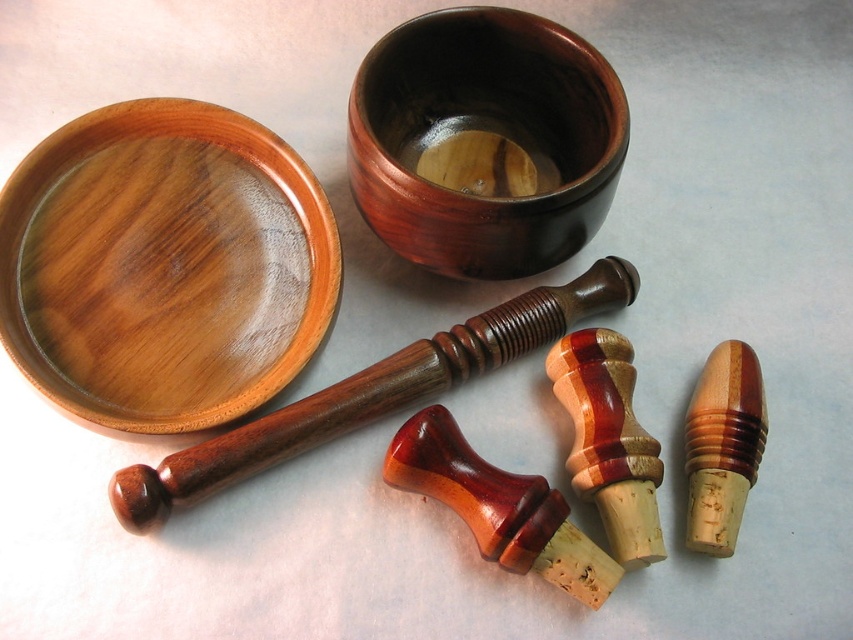
Question: Does wooden bowl at upper left have a lesser width compared to dark wood bowl at center?

Choices:
 (A) yes
 (B) no

Answer: (B)

Question: Which of the following is the farthest from the observer?

Choices:
 (A) (173, 166)
 (B) (468, 198)

Answer: (A)

Question: Among these points, which one is nearest to the camera?

Choices:
 (A) (599, 124)
 (B) (167, 100)

Answer: (B)

Question: Which of the following is the closest to the observer?

Choices:
 (A) (541, 108)
 (B) (201, 237)

Answer: (B)

Question: Does wooden bowl at upper left have a greater width compared to dark wood bowl at center?

Choices:
 (A) yes
 (B) no

Answer: (A)

Question: Does wooden bowl at upper left come in front of dark wood bowl at center?

Choices:
 (A) no
 (B) yes

Answer: (B)